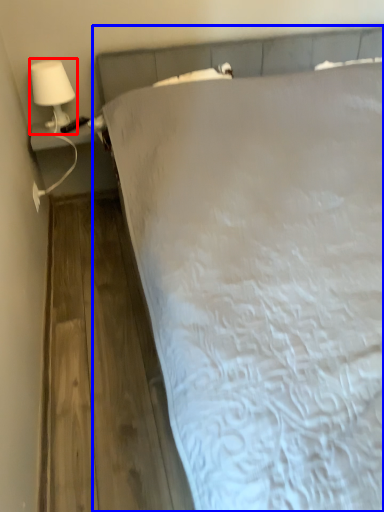
Question: Which of the following is the closest to the observer, lamp (highlighted by a red box) or bed (highlighted by a blue box)?

Choices:
 (A) lamp
 (B) bed

Answer: (B)